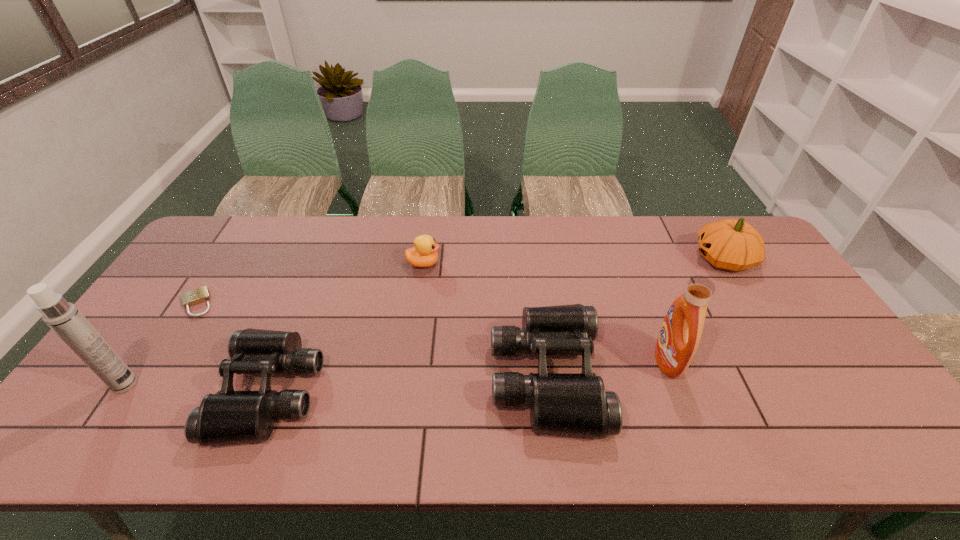
At what (x,y) coordinates should I click in order to perform the action: click on object at the right edge. Please return your answer as a coordinate pair (x, y). This screenshot has width=960, height=540. Looking at the image, I should click on (729, 244).

At what (x,y) coordinates should I click in order to perform the action: click on object that is positioned at the near left corner. Please return your answer as a coordinate pair (x, y). Looking at the image, I should click on (63, 317).

Identify the location of object that is positioned at the far right corner. Image resolution: width=960 pixels, height=540 pixels. (729, 244).

The image size is (960, 540). I want to click on vacant position at the far edge of the desktop, so click(x=300, y=239).

Identify the location of free space at the near edge. (694, 386).

Locate an element on the screen. blank space at the right edge of the desktop is located at coordinates (793, 310).

At what (x,y) coordinates should I click in order to perform the action: click on unoccupied position between the taller binoculars and the detergent. Please return your answer as a coordinate pair (x, y). Looking at the image, I should click on (607, 368).

Where is `free spot between the fourth object from right to left and the gourd`? The width and height of the screenshot is (960, 540). free spot between the fourth object from right to left and the gourd is located at coordinates click(573, 261).

Where is `free area in between the tallest object and the duckling`? free area in between the tallest object and the duckling is located at coordinates (275, 324).

Locate an element on the screen. This screenshot has height=540, width=960. vacant space that is in between the fifth object from left to right and the duckling is located at coordinates (485, 320).